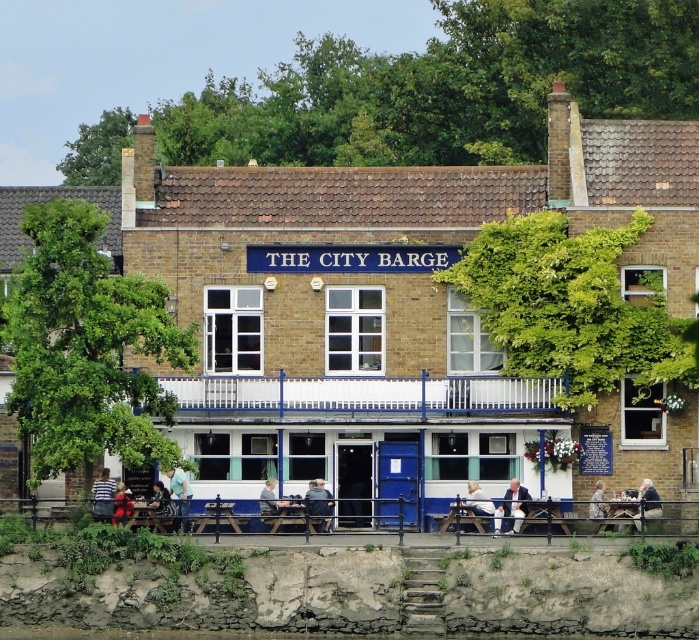
Based on the photo, you are a photographer planning to take a photo of the rough stone wall at lower left and the light blue shirt at lower center. Considering their sizes, which object should you focus on first to ensure both are in frame without moving the camera?

The rough stone wall at lower left has a larger size compared to the light blue shirt at lower center. To ensure both are in frame without moving the camera, you should focus on the rough stone wall at lower left first since it is larger and requires more attention to composition.

You are a photographer taking a picture of the outdoor seating area at The City Barge. You notice a striped shirt at lower left and a light gray fabric jacket at center. Which clothing item is closer to the camera?

The striped shirt at lower left is positioned under the light gray fabric jacket at center, so it is closer to the camera.

You are a visitor approaching the entrance of THE CITY BARGE and want to sit on the light brown wooden bench at lower right. However, there is a light gray fabric jacket at center in your path. Can you walk around the jacket to reach the bench without disturbing it?

The light brown wooden bench at lower right is closer to the viewer than the light gray fabric jacket at center, so you can walk around the jacket to reach the bench without disturbing it.